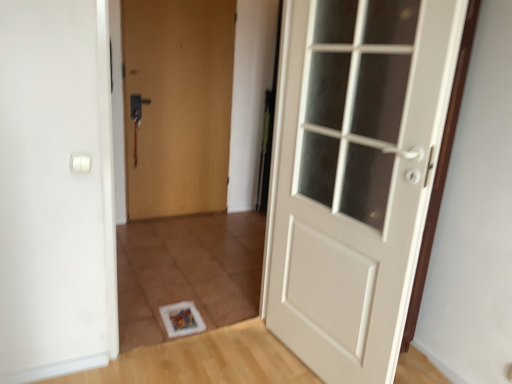
Question: From a real-world perspective, is matte wood door at center, which is the 2th door from right to left, below white glossy door at center, which is the first door from right to left?

Choices:
 (A) yes
 (B) no

Answer: (B)

Question: From the image's perspective, does matte wood door at center, which is the 1th door from back to front, appear higher than white glossy door at center, which ranks as the 2th door in back-to-front order?

Choices:
 (A) yes
 (B) no

Answer: (A)

Question: Considering the relative sizes of matte wood door at center, arranged as the second door when viewed from the front, and white glossy door at center, which is the first door from right to left, in the image provided, is matte wood door at center, arranged as the second door when viewed from the front, thinner than white glossy door at center, which is the first door from right to left,?

Choices:
 (A) no
 (B) yes

Answer: (B)

Question: Is matte wood door at center, arranged as the 1th door when viewed from the left, directly adjacent to white glossy door at center, which is the second door in left-to-right order?

Choices:
 (A) yes
 (B) no

Answer: (B)

Question: Is matte wood door at center, which is the 2th door from right to left, taller than white glossy door at center, which ranks as the 2th door in back-to-front order?

Choices:
 (A) yes
 (B) no

Answer: (A)

Question: Is white glossy door at center, which is the first door from right to left, inside matte wood door at center, arranged as the 1th door when viewed from the left?

Choices:
 (A) no
 (B) yes

Answer: (A)

Question: Can we say white glossy door at center, which ranks as the first door in front-to-back order, lies outside matte wood door at center, which is the 1th door from back to front?

Choices:
 (A) no
 (B) yes

Answer: (B)

Question: From the image's perspective, does white glossy door at center, which is the second door in left-to-right order, appear lower than matte wood door at center, arranged as the second door when viewed from the front?

Choices:
 (A) no
 (B) yes

Answer: (B)

Question: Is white glossy door at center, which ranks as the first door in front-to-back order, aimed at matte wood door at center, which is the 2th door from right to left?

Choices:
 (A) yes
 (B) no

Answer: (B)

Question: Does white glossy door at center, which ranks as the first door in front-to-back order, have a smaller size compared to matte wood door at center, arranged as the 1th door when viewed from the left?

Choices:
 (A) yes
 (B) no

Answer: (B)

Question: Is white glossy door at center, which is the second door in left-to-right order, turned away from matte wood door at center, arranged as the second door when viewed from the front?

Choices:
 (A) no
 (B) yes

Answer: (A)

Question: Is white glossy door at center, which ranks as the first door in front-to-back order, further to camera compared to matte wood door at center, which is the 1th door from back to front?

Choices:
 (A) yes
 (B) no

Answer: (B)

Question: From the image's perspective, is white glossy door at center, which is the second door in left-to-right order, located above or below matte wood door at center, which is the 1th door from back to front?

Choices:
 (A) above
 (B) below

Answer: (B)